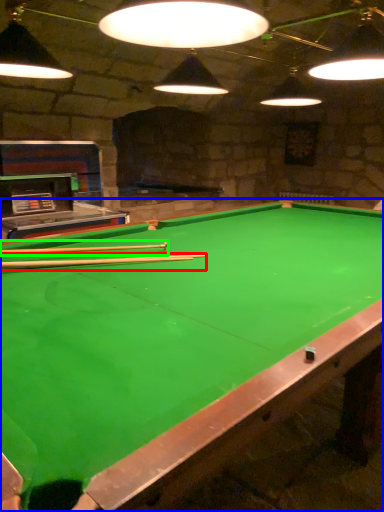
Question: Based on their relative distances, which object is nearer to cue (highlighted by a red box)? Choose from billiard table (highlighted by a blue box) and cue (highlighted by a green box).

Choices:
 (A) billiard table
 (B) cue

Answer: (B)